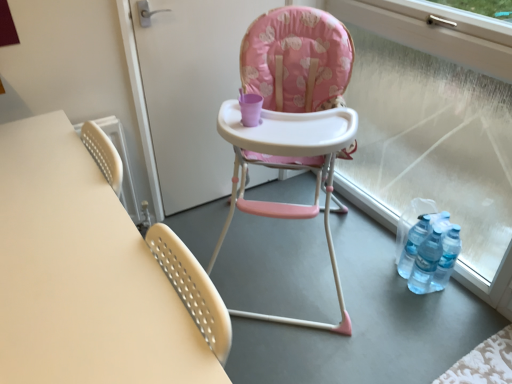
What do you see at coordinates (192, 91) in the screenshot? This screenshot has height=384, width=512. I see `pink fabric high chair at center` at bounding box center [192, 91].

What do you see at coordinates (79, 275) in the screenshot?
I see `matte white table at left` at bounding box center [79, 275].

The image size is (512, 384). What are the coordinates of `matte white table at left` in the screenshot? It's located at (x=79, y=275).

At what (x,y) coordinates should I click in order to perform the action: click on pink fabric highchair at center. Please return your answer as a coordinate pair (x, y). Looking at the image, I should click on (292, 118).

Would you say pink fabric high chair at center is to the left or to the right of matte white table at left in the picture?

From the image, it's evident that pink fabric high chair at center is to the right of matte white table at left.

Is pink fabric high chair at center not within matte white table at left?

Absolutely, pink fabric high chair at center is external to matte white table at left.

Considering the positions of objects pink fabric high chair at center and matte white table at left in the image provided, who is behind, pink fabric high chair at center or matte white table at left?

Positioned behind is pink fabric high chair at center.

Considering the sizes of objects pink fabric high chair at center and matte white table at left in the image provided, who is bigger, pink fabric high chair at center or matte white table at left?

With larger size is matte white table at left.

Is transparent glass window at right next to pink fabric high chair at center and touching it?

No.

Which point is more forward, [462,93] or [268,175]?

The point [462,93] is closer.

Who is smaller, transparent glass window at right or pink fabric high chair at center?

pink fabric high chair at center.

Is pink fabric highchair at center beside transparent glass window at right?

No, pink fabric highchair at center is not beside transparent glass window at right.

Which of these two, pink fabric highchair at center or transparent glass window at right, is thinner?

With smaller width is transparent glass window at right.

This screenshot has height=384, width=512. Find the location of `window frame positioned vertically above the pink fabric highchair at center (from a real-world perspective)`. window frame positioned vertically above the pink fabric highchair at center (from a real-world perspective) is located at coordinates (433, 122).

Relative to transparent glass window at right, is pink fabric highchair at center in front or behind?

Visually, pink fabric highchair at center is located in front of transparent glass window at right.

Can you tell me how much transparent glass window at right and pink fabric highchair at center differ in facing direction?

The angular difference between transparent glass window at right and pink fabric highchair at center is 47.5 degrees.

Locate an element on the screen. The width and height of the screenshot is (512, 384). window frame above the pink fabric highchair at center (from the image's perspective) is located at coordinates (433, 122).

In the scene shown: Would you say transparent glass window at right is outside pink fabric highchair at center?

Yes.

Is transparent glass window at right far away from pink fabric highchair at center?

No, there isn't a large distance between transparent glass window at right and pink fabric highchair at center.

Does pink fabric high chair at center have a greater width compared to transparent glass window at right?

No, pink fabric high chair at center is not wider than transparent glass window at right.

Which is correct: pink fabric high chair at center is inside transparent glass window at right, or outside of it?

pink fabric high chair at center is not inside transparent glass window at right, it's outside.

Is point (207, 3) closer or farther from the camera than point (465, 60)?

Point (207, 3) is positioned farther from the camera compared to point (465, 60).

From the image's perspective, is pink fabric high chair at center located beneath transparent glass window at right?

Incorrect, from the image's perspective, pink fabric high chair at center is higher than transparent glass window at right.

From a real-world perspective, who is located lower, pink fabric highchair at center or pink fabric high chair at center?

From a 3D spatial view, pink fabric highchair at center is below.

Is the position of pink fabric highchair at center less distant than that of pink fabric high chair at center?

Yes, pink fabric highchair at center is in front of pink fabric high chair at center.

The image size is (512, 384). I want to click on chair below the pink fabric high chair at center (from a real-world perspective), so click(x=292, y=118).

Could pink fabric high chair at center be considered to be inside pink fabric highchair at center?

Definitely not — pink fabric high chair at center is not inside pink fabric highchair at center.

Considering the sizes of objects matte white table at left and pink fabric highchair at center in the image provided, who is shorter, matte white table at left or pink fabric highchair at center?

matte white table at left.

How many degrees apart are the facing directions of matte white table at left and pink fabric highchair at center?

The angle between the facing direction of matte white table at left and the facing direction of pink fabric highchair at center is 48.1 degrees.

Can you confirm if matte white table at left is positioned to the right of pink fabric highchair at center?

No, matte white table at left is not to the right of pink fabric highchair at center.

Which is behind, point (12, 354) or point (303, 154)?

Positioned behind is point (303, 154).

You are a GUI agent. You are given a task and a screenshot of the screen. Output one action in this format:
    pyautogui.click(x=<x>, y=<y>)
    Task: Click on the table below the pink fabric high chair at center (from the image's perspective)
    The height and width of the screenshot is (384, 512).
    Given the screenshot: What is the action you would take?
    point(79,275)

Identify the location of window frame in front of the pink fabric high chair at center. (433, 122).

In the scene shown: From the image, which object appears to be nearer to pink fabric high chair at center, matte white table at left or pink fabric highchair at center?

pink fabric highchair at center is positioned closer to the anchor pink fabric high chair at center.

Looking at the image, which one is located further to matte white table at left, transparent glass window at right or pink fabric highchair at center?

transparent glass window at right is positioned further to the anchor matte white table at left.

Which object lies nearer to the anchor point pink fabric high chair at center, transparent glass window at right or matte white table at left?

The object closer to pink fabric high chair at center is transparent glass window at right.

Estimate the real-world distances between objects in this image. Which object is further from pink fabric highchair at center, transparent glass window at right or pink fabric high chair at center?

transparent glass window at right is further to pink fabric highchair at center.

When comparing their distances from pink fabric highchair at center, does pink fabric high chair at center or matte white table at left seem further?

matte white table at left is positioned further to the anchor pink fabric highchair at center.

From the image, which object appears to be nearer to pink fabric high chair at center, pink fabric highchair at center or transparent glass window at right?

pink fabric highchair at center is positioned closer to the anchor pink fabric high chair at center.

Estimate the real-world distances between objects in this image. Which object is closer to matte white table at left, pink fabric high chair at center or pink fabric highchair at center?

The object closer to matte white table at left is pink fabric highchair at center.

Looking at the image, which one is located further to pink fabric high chair at center, matte white table at left or transparent glass window at right?

The object further to pink fabric high chair at center is matte white table at left.

Locate an element on the screen. The height and width of the screenshot is (384, 512). chair between matte white table at left and transparent glass window at right is located at coordinates (292, 118).

This screenshot has width=512, height=384. I want to click on screen door situated between matte white table at left and transparent glass window at right from left to right, so click(192, 91).

Locate an element on the screen. The width and height of the screenshot is (512, 384). chair between pink fabric high chair at center and transparent glass window at right is located at coordinates (292, 118).

Identify the location of screen door between matte white table at left and pink fabric highchair at center in the horizontal direction. The height and width of the screenshot is (384, 512). point(192,91).